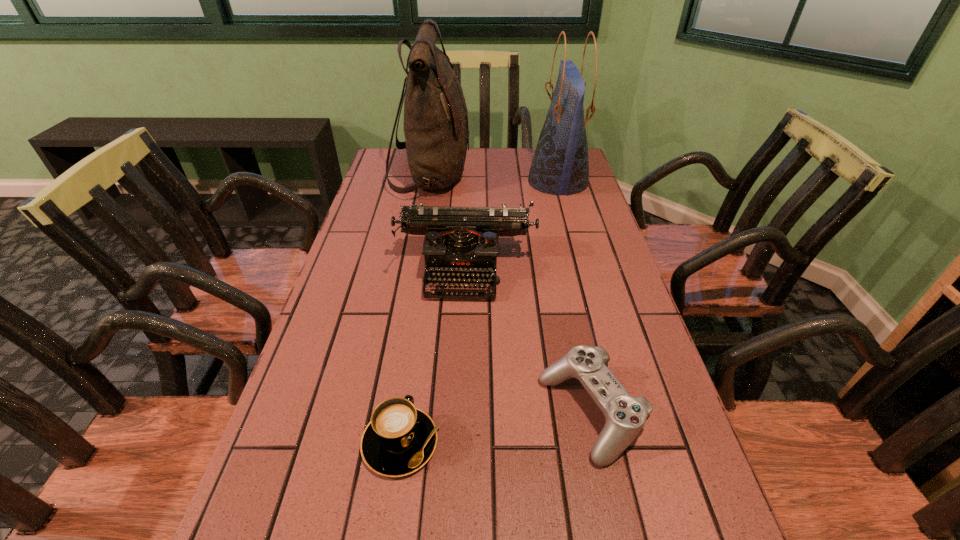
Locate which object ranks third in proximity to the cappuccino. Please provide its 2D coordinates. Your answer should be formatted as a tuple, i.e. [(x, y)], where the tuple contains the x and y coordinates of a point satisfying the conditions above.

[(436, 130)]

Image resolution: width=960 pixels, height=540 pixels. I want to click on vacant point that satisfies the following two spatial constraints: 1. on the keyboard of the control; 2. on the right side of the third shortest object, so click(x=460, y=414).

The image size is (960, 540). Identify the location of free space that satisfies the following two spatial constraints: 1. on the open flap of the control; 2. on the right side of the backpack. (391, 414).

I want to click on blank area in the image that satisfies the following two spatial constraints: 1. on the open flap of the backpack; 2. on the left side of the shopping bag, so click(430, 182).

At what (x,y) coordinates should I click in order to perform the action: click on vacant region that satisfies the following two spatial constraints: 1. on the keyboard of the control; 2. on the left side of the third farthest object. Please return your answer as a coordinate pair (x, y). The width and height of the screenshot is (960, 540). Looking at the image, I should click on point(460,414).

Image resolution: width=960 pixels, height=540 pixels. Identify the location of free space in the image that satisfies the following two spatial constraints: 1. on the keyboard of the control; 2. on the right side of the third tallest object. (460, 414).

This screenshot has height=540, width=960. I want to click on vacant space that satisfies the following two spatial constraints: 1. on the open flap of the backpack; 2. on the back side of the control, so click(x=391, y=414).